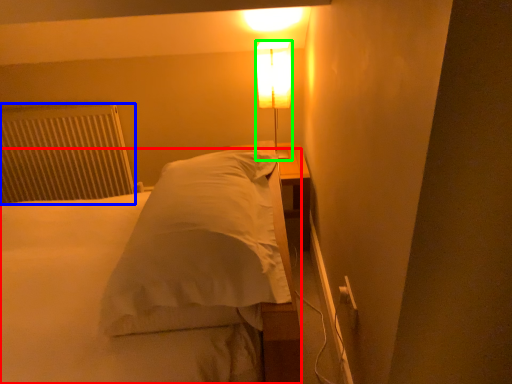
Question: Considering the real-world distances, which object is closest to bed (highlighted by a red box)? radiator (highlighted by a blue box) or lamp (highlighted by a green box).

Choices:
 (A) radiator
 (B) lamp

Answer: (A)